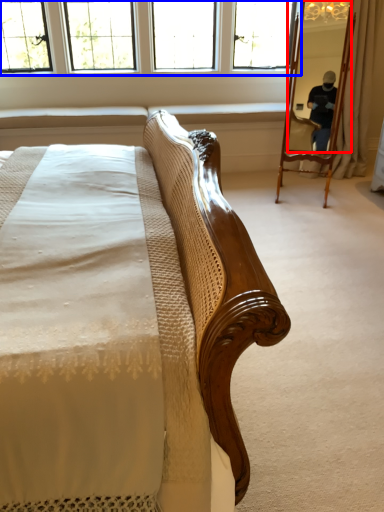
Question: Among these objects, which one is nearest to the camera, mirror (highlighted by a red box) or window (highlighted by a blue box)?

Choices:
 (A) mirror
 (B) window

Answer: (A)